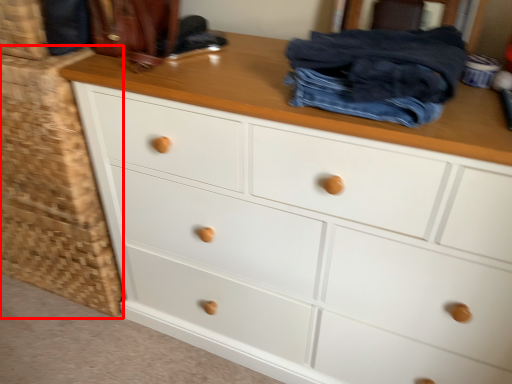
Question: From the image, what is the correct spatial relationship of cabinetry (annotated by the red box) in relation to clothing?

Choices:
 (A) right
 (B) left

Answer: (B)